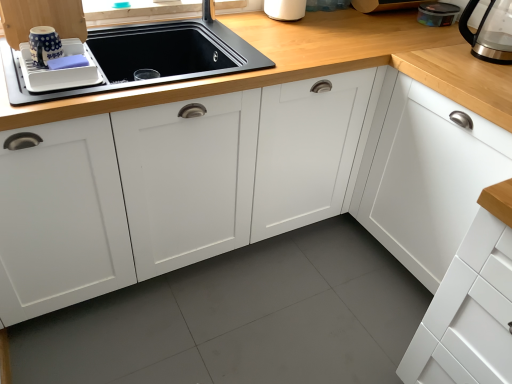
Question: Is white plastic dish drainer at upper left, the 1th appliance viewed from the front, completely or partially outside of transparent glass coffeepot at upper right?

Choices:
 (A) yes
 (B) no

Answer: (A)

Question: Can you confirm if white plastic dish drainer at upper left, the 4th appliance from the back, is smaller than transparent glass coffeepot at upper right?

Choices:
 (A) no
 (B) yes

Answer: (A)

Question: Does white plastic dish drainer at upper left, the first appliance viewed from the left, have a lesser width compared to transparent glass coffeepot at upper right?

Choices:
 (A) yes
 (B) no

Answer: (B)

Question: Is white plastic dish drainer at upper left, which is the 4th appliance from right to left, far from transparent glass coffeepot at upper right?

Choices:
 (A) yes
 (B) no

Answer: (A)

Question: Can you confirm if white plastic dish drainer at upper left, the 4th appliance from the back, is bigger than transparent glass coffeepot at upper right?

Choices:
 (A) no
 (B) yes

Answer: (B)

Question: Is transparent glass coffeepot at upper right to the left or to the right of blue dotted cup at upper left, which is the 2th appliance from front to back, in the image?

Choices:
 (A) left
 (B) right

Answer: (B)

Question: Is point (466, 21) positioned closer to the camera than point (46, 31)?

Choices:
 (A) farther
 (B) closer

Answer: (A)

Question: From the image's perspective, relative to blue dotted cup at upper left, which is the third appliance from back to front, is transparent glass coffeepot at upper right above or below?

Choices:
 (A) below
 (B) above

Answer: (B)

Question: Which is correct: transparent glass coffeepot at upper right is inside blue dotted cup at upper left, the second appliance in the left-to-right sequence, or outside of it?

Choices:
 (A) outside
 (B) inside

Answer: (A)

Question: Considering the positions of transparent plastic container at upper right, which ranks as the first appliance in right-to-left order, and white glossy tray at upper left, the first cabinetry when ordered from left to right, in the image, is transparent plastic container at upper right, which ranks as the first appliance in right-to-left order, wider or thinner than white glossy tray at upper left, the first cabinetry when ordered from left to right,?

Choices:
 (A) wide
 (B) thin

Answer: (A)

Question: Would you say transparent plastic container at upper right, the second appliance viewed from the back, is inside or outside white glossy tray at upper left, the first cabinetry when ordered from left to right?

Choices:
 (A) inside
 (B) outside

Answer: (B)

Question: In the image, is transparent plastic container at upper right, which ranks as the first appliance in right-to-left order, on the left side or the right side of white glossy tray at upper left, the first cabinetry when ordered from left to right?

Choices:
 (A) right
 (B) left

Answer: (A)

Question: From the image's perspective, is transparent plastic container at upper right, the second appliance viewed from the back, located above or below white glossy tray at upper left, which is the third cabinetry in right-to-left order?

Choices:
 (A) below
 (B) above

Answer: (B)

Question: Do you think white glossy tray at upper left, which is the third cabinetry in right-to-left order, is within transparent plastic container at upper right, the fourth appliance when ordered from left to right, or outside of it?

Choices:
 (A) inside
 (B) outside

Answer: (B)

Question: Considering the positions of white glossy tray at upper left, the first cabinetry when ordered from left to right, and transparent plastic container at upper right, which is the third appliance from front to back, in the image, is white glossy tray at upper left, the first cabinetry when ordered from left to right, taller or shorter than transparent plastic container at upper right, which is the third appliance from front to back,?

Choices:
 (A) tall
 (B) short

Answer: (A)